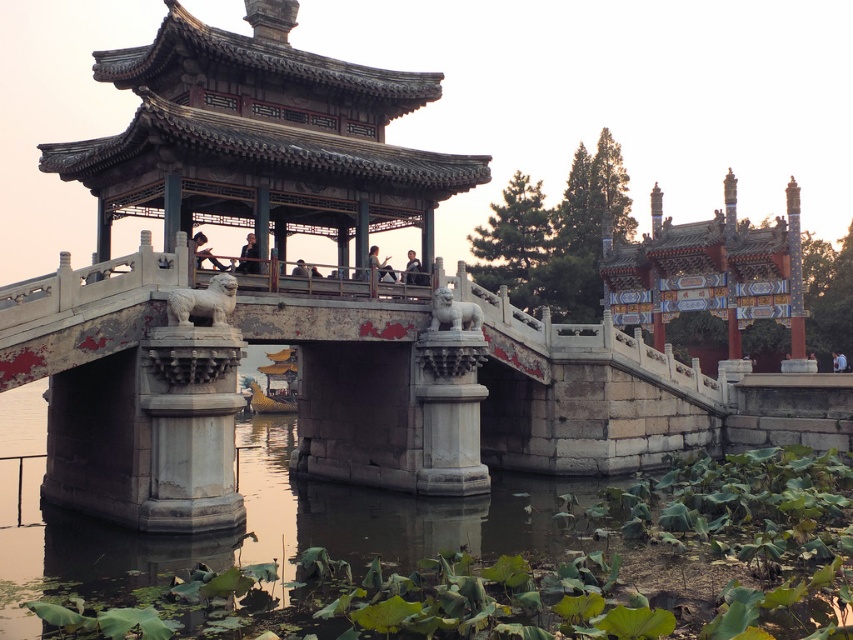
Question: Is stone gazebo at center in front of light brown wooden bench at center?

Choices:
 (A) yes
 (B) no

Answer: (A)

Question: Based on their relative distances, which object is nearer to the white stone bridge at center?

Choices:
 (A) smooth black shirt at center
 (B) stone gazebo at center

Answer: (B)

Question: Which object is farther from the camera taking this photo?

Choices:
 (A) white stone bridge at center
 (B) matte black shirt at upper center
 (C) light brown wooden bench at center
 (D) smooth black shirt at center

Answer: (C)

Question: From the image, what is the correct spatial relationship of white stone bridge at center in relation to light brown wooden bench at center?

Choices:
 (A) right
 (B) left

Answer: (B)

Question: Observing the image, what is the correct spatial positioning of white stone bridge at center in reference to smooth black shirt at center?

Choices:
 (A) below
 (B) above

Answer: (A)

Question: Among these points, which one is farthest from the camera?

Choices:
 (A) (16, 381)
 (B) (252, 240)

Answer: (B)